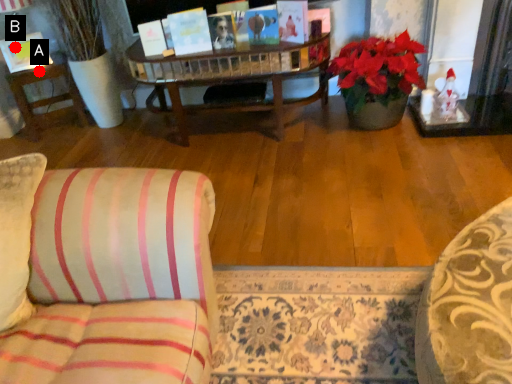
Question: Two points are circled on the image, labeled by A and B beside each circle. Which point is farther to the camera?

Choices:
 (A) A is further
 (B) B is further

Answer: (A)